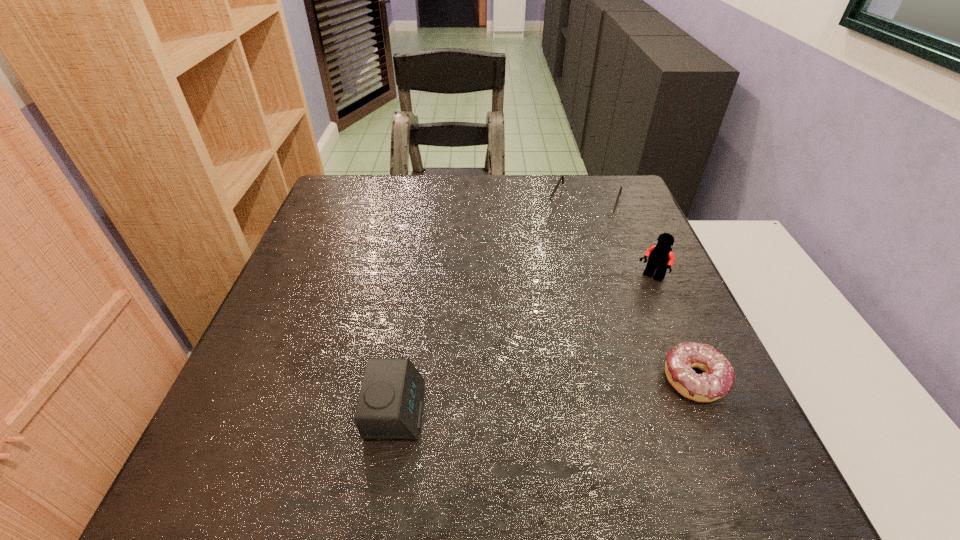
I want to click on the second tallest object, so click(390, 404).

You are a GUI agent. You are given a task and a screenshot of the screen. Output one action in this format:
    pyautogui.click(x=<x>, y=<y>)
    Task: Click on the leftmost object
    The width and height of the screenshot is (960, 540).
    Given the screenshot: What is the action you would take?
    pyautogui.click(x=390, y=404)

Identify the location of doughnut. (718, 379).

In order to click on the tallest object in this screenshot , I will do `click(660, 257)`.

Identify the location of Lego. The width and height of the screenshot is (960, 540). (660, 257).

This screenshot has height=540, width=960. What are the coordinates of `spectacles` in the screenshot? It's located at (595, 215).

Locate an element on the screen. vacant area situated 0.130m on the front-facing side of the leftmost object is located at coordinates (497, 410).

Identify the location of free space located on the left of the doughnut. (485, 380).

Locate an element on the screen. This screenshot has height=540, width=960. free space located on the front-facing side of the Lego is located at coordinates (606, 326).

Find the location of a particular element. The height and width of the screenshot is (540, 960). blank space located on the front-facing side of the Lego is located at coordinates (558, 377).